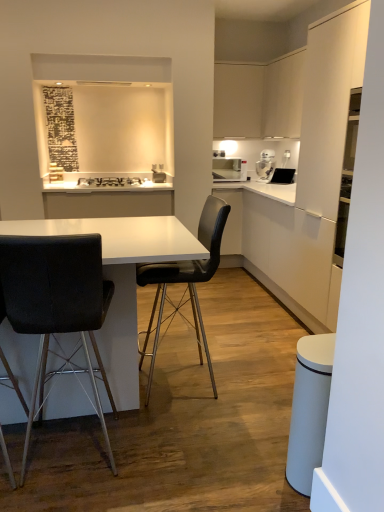
Question: Is white glossy coffee machine at upper right aimed at matte white microwave at upper right?

Choices:
 (A) yes
 (B) no

Answer: (B)

Question: Considering the relative positions of white glossy coffee machine at upper right and matte white microwave at upper right in the image provided, is white glossy coffee machine at upper right in front of matte white microwave at upper right?

Choices:
 (A) yes
 (B) no

Answer: (A)

Question: From a real-world perspective, does white glossy coffee machine at upper right stand above matte white microwave at upper right?

Choices:
 (A) no
 (B) yes

Answer: (B)

Question: Does white glossy coffee machine at upper right lie behind matte white microwave at upper right?

Choices:
 (A) no
 (B) yes

Answer: (A)

Question: Does white glossy coffee machine at upper right have a greater width compared to matte white microwave at upper right?

Choices:
 (A) no
 (B) yes

Answer: (A)

Question: From a real-world perspective, is white glossy coffee machine at upper right physically below matte white microwave at upper right?

Choices:
 (A) no
 (B) yes

Answer: (A)

Question: Does black leather chair at center, arranged as the first chair when viewed from the right, appear on the left side of white matte cabinet at right?

Choices:
 (A) no
 (B) yes

Answer: (B)

Question: From the image's perspective, would you say black leather chair at center, the 2th chair positioned from the left, is shown under white matte cabinet at right?

Choices:
 (A) no
 (B) yes

Answer: (B)

Question: From the image's perspective, does black leather chair at center, the 2th chair positioned from the left, appear higher than white matte cabinet at right?

Choices:
 (A) yes
 (B) no

Answer: (B)

Question: Can you confirm if black leather chair at center, the 2th chair positioned from the left, is bigger than white matte cabinet at right?

Choices:
 (A) no
 (B) yes

Answer: (A)

Question: Is black leather chair at center, the 2th chair positioned from the left, shorter than white matte cabinet at right?

Choices:
 (A) no
 (B) yes

Answer: (A)

Question: Is black leather chair at center, the 2th chair positioned from the left, outside white matte cabinet at right?

Choices:
 (A) yes
 (B) no

Answer: (A)

Question: Would you say white matte cabinet at right is outside black matte stove at upper center?

Choices:
 (A) yes
 (B) no

Answer: (A)